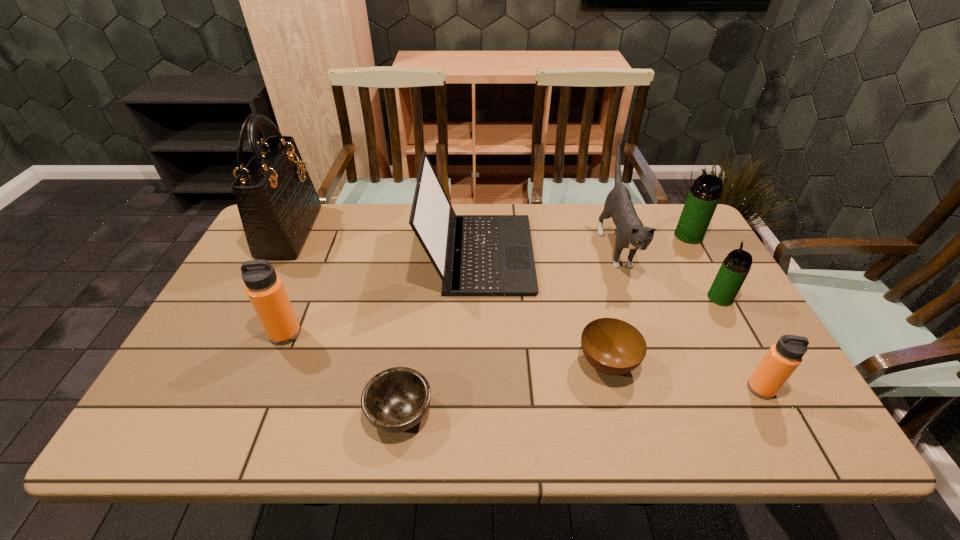
Where is `the leftmost object`? This screenshot has height=540, width=960. the leftmost object is located at coordinates (277, 202).

The width and height of the screenshot is (960, 540). I want to click on handbag, so click(x=277, y=202).

Locate an element on the screen. Image resolution: width=960 pixels, height=540 pixels. cat is located at coordinates (631, 233).

Where is `gray laptop`? gray laptop is located at coordinates (475, 255).

Find the location of `the farthest thermos bottle`. the farthest thermos bottle is located at coordinates (704, 195).

I want to click on the farther green thermos bottle, so click(704, 195).

In order to click on the leftmost thermos bottle in this screenshot , I will do `click(265, 290)`.

Find the location of a particular element. the bigger orange thermos bottle is located at coordinates (265, 290).

Where is `the second farthest thermos bottle`? This screenshot has height=540, width=960. the second farthest thermos bottle is located at coordinates (736, 266).

Locate an element on the screen. This screenshot has width=960, height=540. the nearer green thermos bottle is located at coordinates (736, 266).